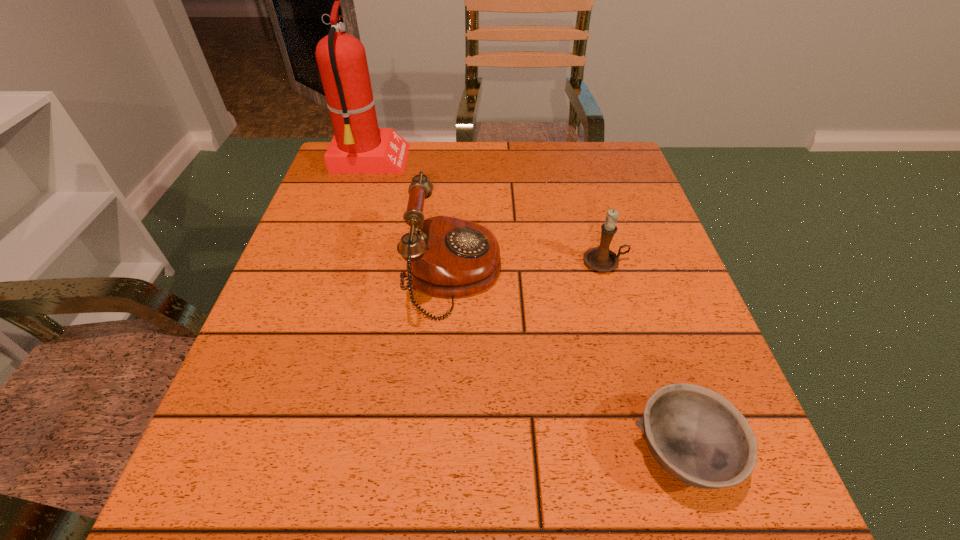
Where is `free point that satisfies the following two spatial constraints: 1. on the dial of the telephone; 2. on the right side of the nearest object`? The width and height of the screenshot is (960, 540). free point that satisfies the following two spatial constraints: 1. on the dial of the telephone; 2. on the right side of the nearest object is located at coordinates (444, 452).

Where is `vacant area that satisfies the following two spatial constraints: 1. on the dial of the telephone; 2. on the left side of the nearest object`? The width and height of the screenshot is (960, 540). vacant area that satisfies the following two spatial constraints: 1. on the dial of the telephone; 2. on the left side of the nearest object is located at coordinates (444, 452).

Where is `vacant space that satisfies the following two spatial constraints: 1. on the front-facing side of the leftmost object; 2. on the left side of the nearest object`? This screenshot has width=960, height=540. vacant space that satisfies the following two spatial constraints: 1. on the front-facing side of the leftmost object; 2. on the left side of the nearest object is located at coordinates (276, 452).